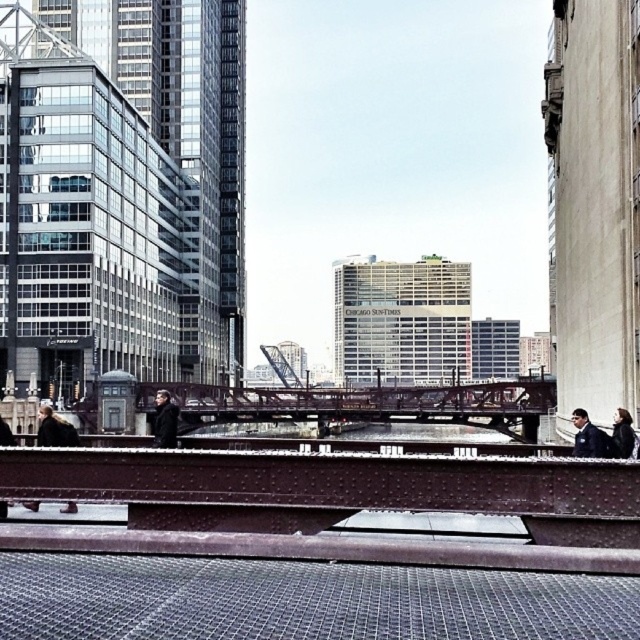
You are standing on the bridge and notice a person wearing a dark blue jacket at right. Where exactly is this person positioned relative to the metal railing in the foreground?

The dark blue jacket at right is located at point 0.683 on the x axis and 0.919 on the y axis, so the person is positioned near the upper right corner of the image, close to the metal railing in the foreground.

You are standing on the bridge and want to reach the point at coordinates point (573, 435). If your walking speed is 3 feet per second, how many seconds will it take to reach that point?

The point (573, 435) is 131.29 feet away from the camera. At a walking speed of 3 feet per second, it would take approximately 43.76 seconds to reach the point. Since the question asks for the time in seconds, rounding to the nearest whole number gives about 44 seconds.

You are a maintenance worker needing to reach the dark blue jacket at right from the metallic steel bench at lower left. Can you walk directly to it without any obstacles?

The distance between the metallic steel bench at lower left and the dark blue jacket at right is 10.04 meters, so yes, you can walk directly to it without any obstacles as there is no mention of obstacles in the scene description.